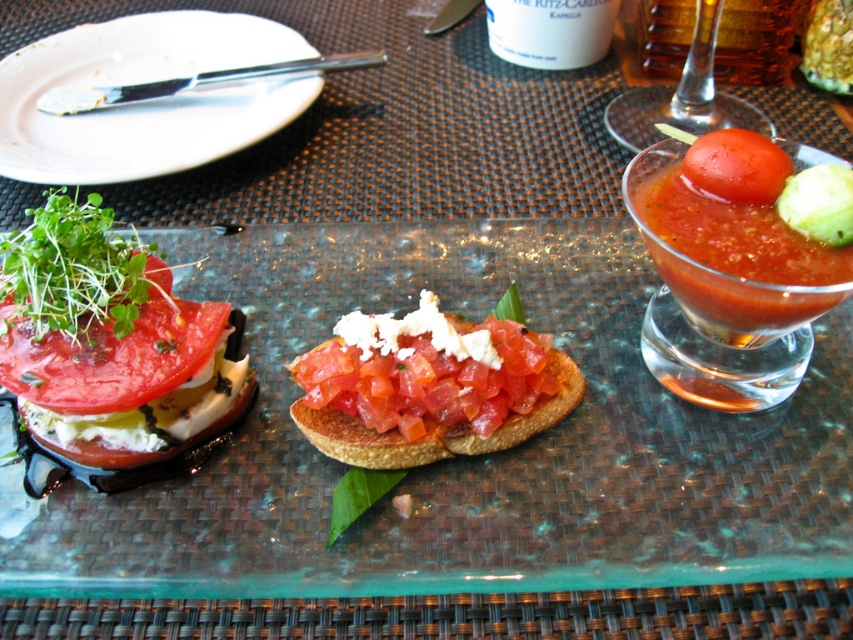
Question: Which point is farther to the camera?

Choices:
 (A) pos(624,177)
 (B) pos(218,568)

Answer: (A)

Question: Which object is closer to the camera taking this photo?

Choices:
 (A) translucent glass cup at upper center
 (B) white ceramic plate at upper left

Answer: (B)

Question: In this image, where is tomato-red smoothie at right located relative to translucent glass cup at upper center?

Choices:
 (A) above
 (B) below

Answer: (B)

Question: Is matte brown bread at center thinner than tomato-red smoothie at right?

Choices:
 (A) no
 (B) yes

Answer: (A)

Question: Among these points, which one is nearest to the camera?

Choices:
 (A) (160, 326)
 (B) (268, 492)

Answer: (A)

Question: Is white ceramic plate at upper left above amber glass wine at upper right?

Choices:
 (A) yes
 (B) no

Answer: (B)